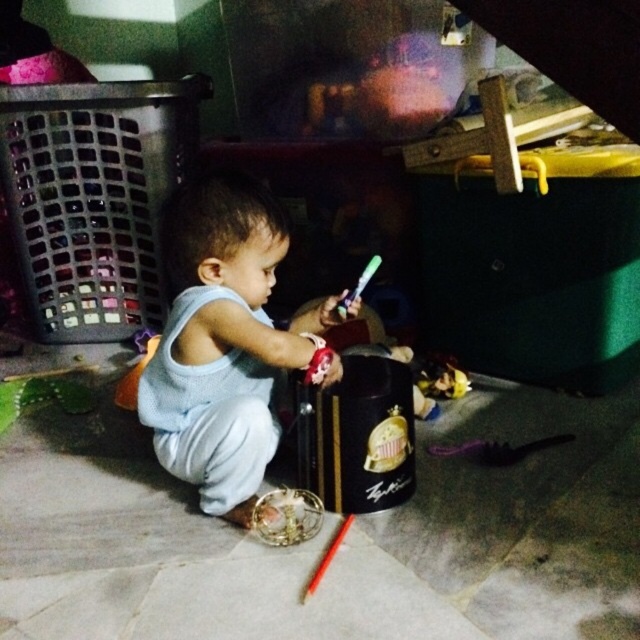
You are a parent trying to reach for the red wooden paint brush at lower center while holding your child, the light blue fabric toddler at center. Can you safely pick up the brush without bending down too much?

The light blue fabric toddler at center is taller than the red wooden paint brush at lower center, so you can likely reach the brush without bending too much since the toddler is taller and may allow you to access it from a higher position.

You are a parent trying to choose a gift for your child. You have a small gift box that can only hold items narrower than the red wooden paint brush at lower center. Can the light blue fabric toddler at center fit into the box?

The light blue fabric toddler at center is wider than the red wooden paint brush at lower center, so it cannot fit into the gift box designed for items narrower than the red wooden paint brush at lower center.

What is located at the point marked as point (225,342) in the image?

The point (225,342) marks the location of the light blue fabric toddler at center.